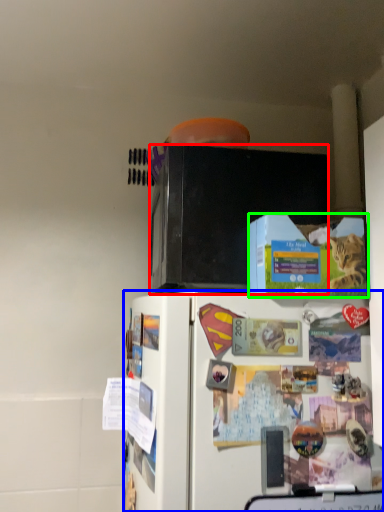
Question: Based on their relative distances, which object is farther from microwave oven (highlighted by a red box)? Choose from refrigerator (highlighted by a blue box) and box (highlighted by a green box).

Choices:
 (A) refrigerator
 (B) box

Answer: (A)